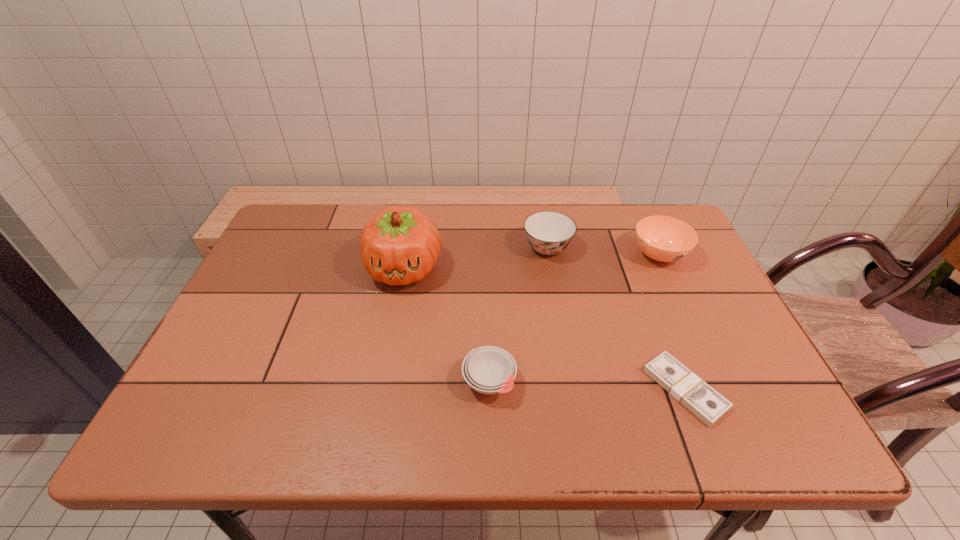
Identify the location of free space between the shortest soup bowl and the shortest object. (587, 386).

Where is `free spot between the fourth object from right to left and the pumpkin`? free spot between the fourth object from right to left and the pumpkin is located at coordinates (446, 325).

Find the location of a particular element. The height and width of the screenshot is (540, 960). free space between the pumpkin and the dollar is located at coordinates (544, 329).

Identify the location of free space between the third object from right to left and the dollar. (616, 319).

Locate an element on the screen. The image size is (960, 540). object that ranks as the second closest to the second soup bowl from left to right is located at coordinates (x=400, y=245).

Find the location of a particular element. This screenshot has width=960, height=540. object that is the third nearest to the leftmost object is located at coordinates (703, 401).

Select which soup bowl appears as the third closest to the dollar. Please provide its 2D coordinates. Your answer should be formatted as a tuple, i.e. [(x, y)], where the tuple contains the x and y coordinates of a point satisfying the conditions above.

[(548, 232)]

Locate which soup bowl is the second closest to the leftmost soup bowl. Please provide its 2D coordinates. Your answer should be formatted as a tuple, i.e. [(x, y)], where the tuple contains the x and y coordinates of a point satisfying the conditions above.

[(665, 239)]

The height and width of the screenshot is (540, 960). Identify the location of vacant point that satisfies the following two spatial constraints: 1. on the side of the nearest soup bowl with the cute face; 2. on the left side of the leftmost object. point(383,382).

Where is `vacant region that satisfies the following two spatial constraints: 1. on the side of the tallest object with the cute face; 2. on the left side of the shortest object`? vacant region that satisfies the following two spatial constraints: 1. on the side of the tallest object with the cute face; 2. on the left side of the shortest object is located at coordinates (381, 389).